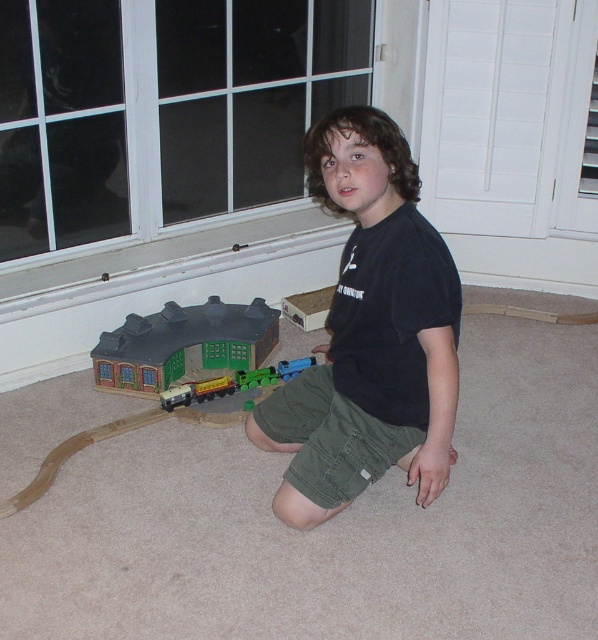
Question: Can you confirm if white wood screen door at upper right is positioned to the left of green plastic train station at lower left?

Choices:
 (A) yes
 (B) no

Answer: (B)

Question: Among these objects, which one is nearest to the camera?

Choices:
 (A) brick-textured train station at lower left
 (B) black cotton shirt at center
 (C) green matte train at center
 (D) white wood screen door at upper right

Answer: (B)

Question: Among these points, which one is farthest from the camera?

Choices:
 (A) (280, 364)
 (B) (271, 384)
 (C) (112, 381)
 (D) (242, 323)

Answer: (D)

Question: Which of the following is the farthest from the observer?

Choices:
 (A) brick-textured train station at lower left
 (B) white wood screen door at upper right
 (C) blue plastic train at center

Answer: (B)

Question: Does green matte train at center have a smaller size compared to blue plastic train at center?

Choices:
 (A) yes
 (B) no

Answer: (B)

Question: Does black cotton shirt at center have a lesser width compared to brick-textured train station at lower left?

Choices:
 (A) no
 (B) yes

Answer: (B)